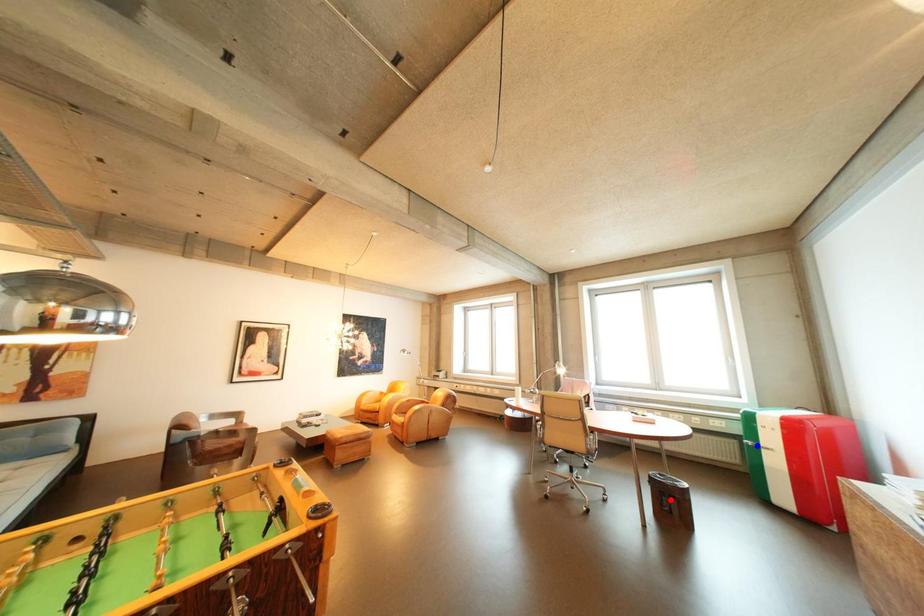
Question: In the image, two points are highlighted. Which point is nearer to the camera? Reply with the corresponding letter.

Choices:
 (A) blue point
 (B) red point

Answer: (B)